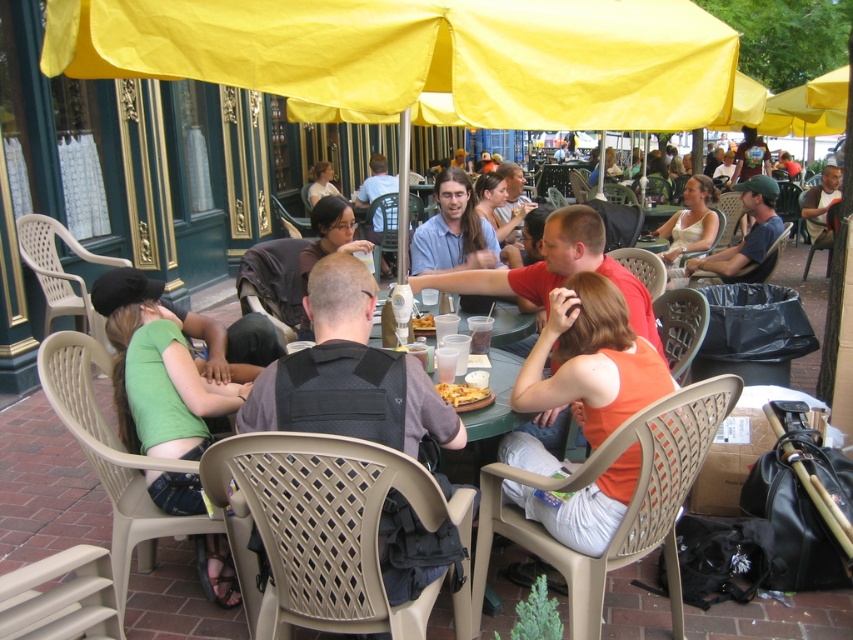
You are a photographer standing at the edge of the outdoor cafe. You want to take a photo that includes both the green fabric shirt at center and the brown leather jacket at upper right. Given that your camera has a maximum zoom range of 3 meters, will you be able to fit both subjects into the frame without moving closer?

The green fabric shirt at center and brown leather jacket at upper right are 4.16 meters apart, which exceeds the camera maximum zoom range of 3 meters. Therefore, you cannot fit both subjects into the frame without moving closer.

You are taking a photo of the outdoor cafe scene. You notice two points in the image, one at coordinates point (473, 403) and another at point (433, 324). Which point will appear larger in your photo?

Point (473, 403) is closer to the camera than point (433, 324), so it will appear larger in the photo.

You are a delivery person who needs to place two pizzas on a 30 inch wide table. The golden crispy pizza at center and the yellow matte pizza at center are both on the table. Can both pizzas fit side by side on the table without overlapping?

The golden crispy pizza at center is 28.67 inches from the yellow matte pizza at center. Since the table is 30 inches wide, both pizzas can fit side by side as the distance between them is less than the table width.